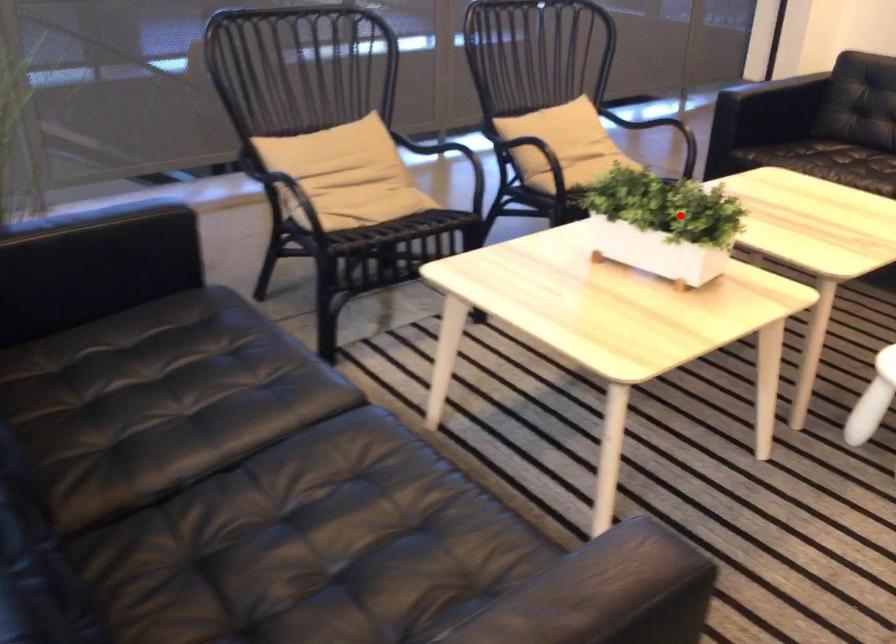
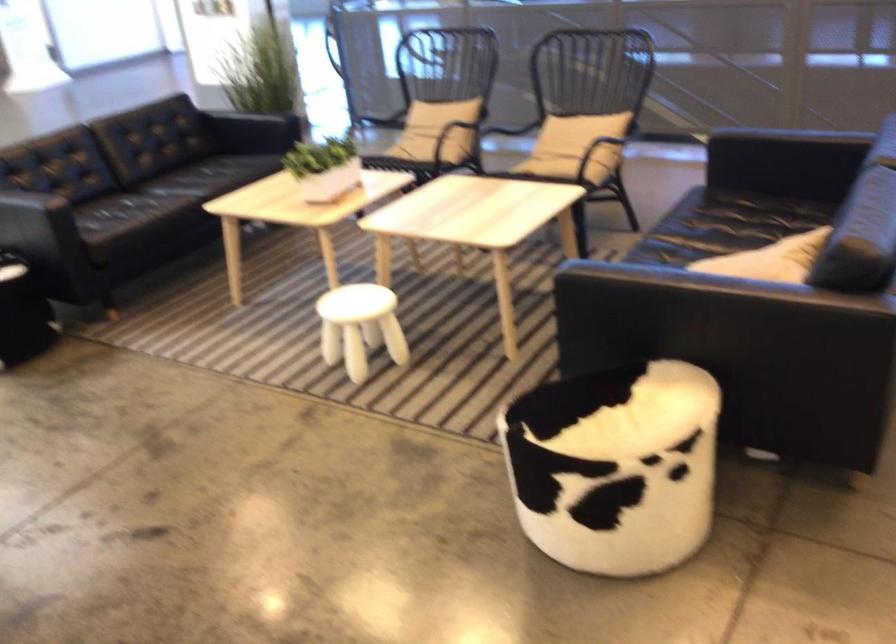
The point at the highlighted location is marked in the first image. Where is the corresponding point in the second image?

(323, 167)